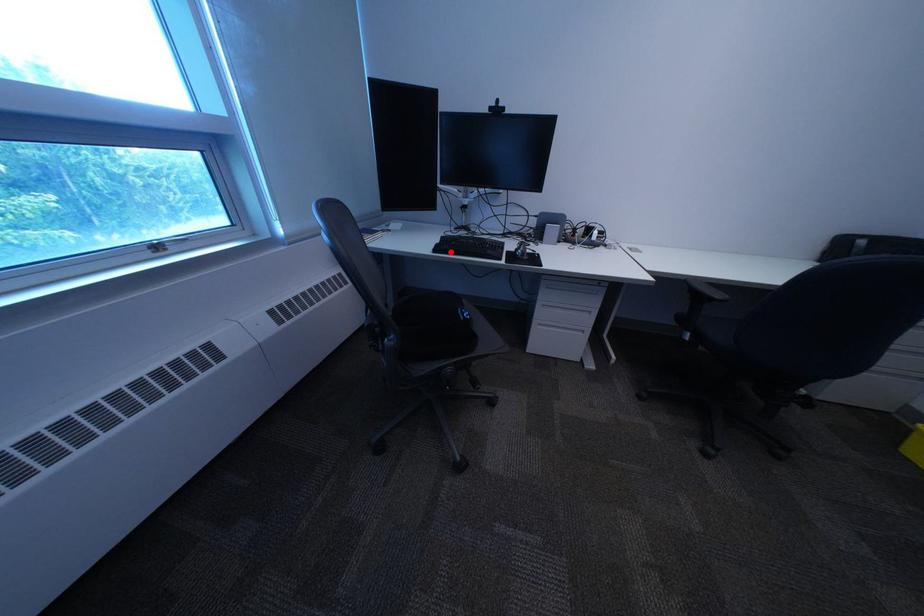
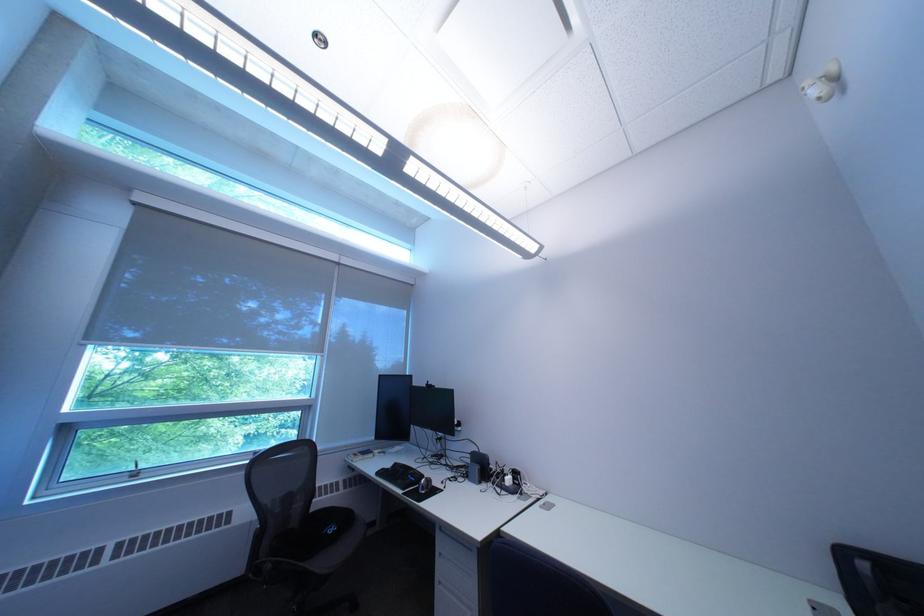
Where in the second image is the point corresponding to the highlighted location from the first image?

(393, 475)